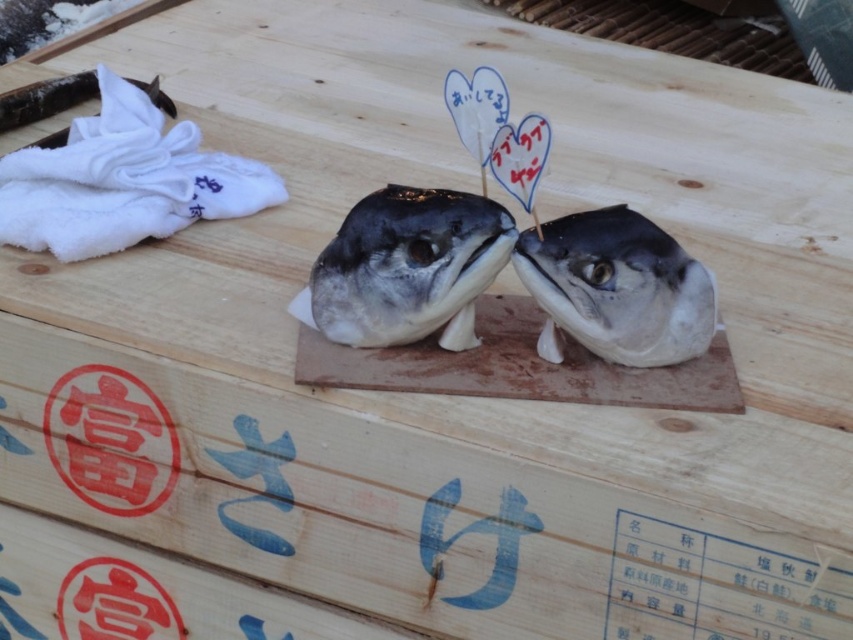
Can you confirm if shiny black fish head at center is positioned to the right of shiny silver fish head at center?

In fact, shiny black fish head at center is to the left of shiny silver fish head at center.

Who is positioned more to the left, shiny black fish head at center or shiny silver fish head at center?

Positioned to the left is shiny black fish head at center.

Is point (332, 316) less distant than point (613, 344)?

No, it is not.

You are a GUI agent. You are given a task and a screenshot of the screen. Output one action in this format:
    pyautogui.click(x=<x>, y=<y>)
    Task: Click on the shiny black fish head at center
    This screenshot has width=853, height=640.
    Given the screenshot: What is the action you would take?
    pyautogui.click(x=407, y=268)

Does white towel at upper left appear on the left side of shiny black fish head at center?

Correct, you'll find white towel at upper left to the left of shiny black fish head at center.

Between white towel at upper left and shiny black fish head at center, which one is positioned higher?

white towel at upper left

Between point (128, 205) and point (454, 340), which one is positioned behind?

Point (128, 205)

In order to click on white towel at upper left in this screenshot , I will do `click(123, 180)`.

Is white towel at upper left below shiny silver fish head at center?

Incorrect, white towel at upper left is not positioned below shiny silver fish head at center.

Does point (48, 236) come in front of point (534, 248)?

No, (48, 236) is further to viewer.

Identify the location of white towel at upper left. The image size is (853, 640). (123, 180).